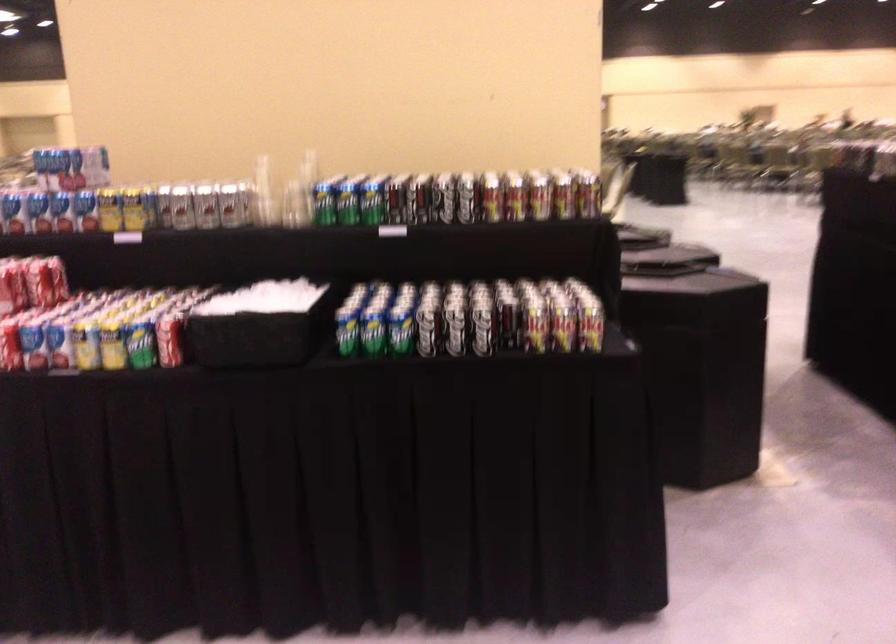
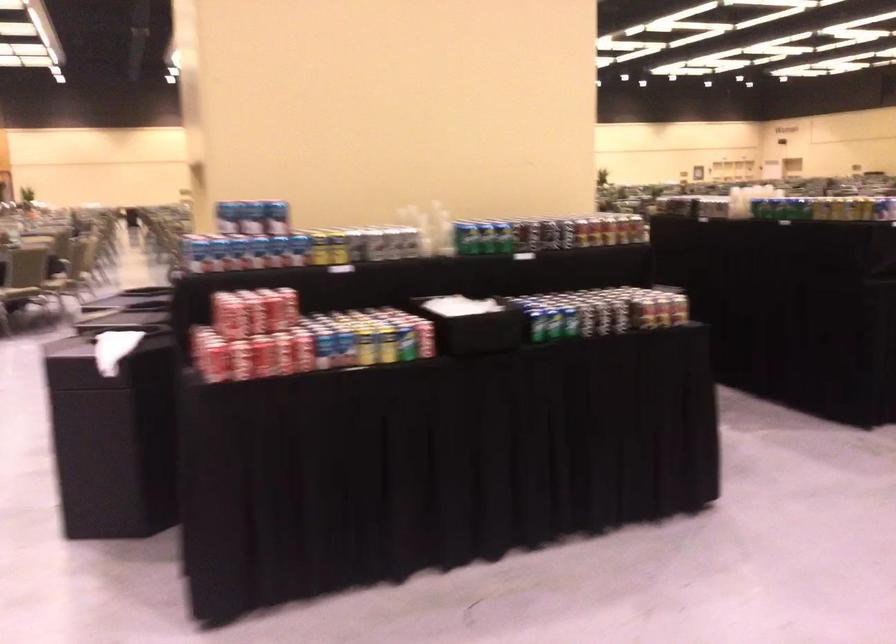
Where in the second image is the point corresponding to point 372,333 from the first image?

(556, 323)